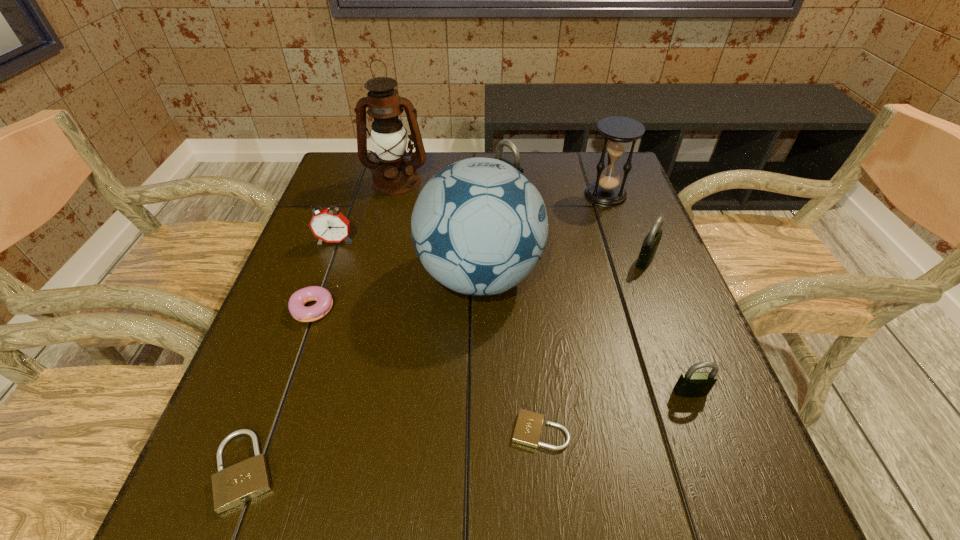
The image size is (960, 540). What are the coordinates of `object located in the far right corner section of the desktop` in the screenshot? It's located at (618, 132).

This screenshot has width=960, height=540. In the image, there is a desktop. Identify the location of vacant space at the far edge. (537, 173).

What are the coordinates of `vacant space at the near edge of the desktop` in the screenshot? It's located at (473, 514).

Find the location of `vacant region at the left edge of the desktop`. vacant region at the left edge of the desktop is located at coordinates (288, 274).

In the image, there is a desktop. Identify the location of vacant space at the right edge. (651, 393).

You are a GUI agent. You are given a task and a screenshot of the screen. Output one action in this format:
    pyautogui.click(x=<x>, y=<y>)
    Task: Click on the free space at the far left corner of the desktop
    
    Given the screenshot: What is the action you would take?
    pyautogui.click(x=329, y=179)

Where is `blank region between the lantern and the fourth tallest padlock`? This screenshot has width=960, height=540. blank region between the lantern and the fourth tallest padlock is located at coordinates (321, 326).

Where is `vacant area that lies between the third tallest padlock and the second biggest black padlock`? vacant area that lies between the third tallest padlock and the second biggest black padlock is located at coordinates (668, 326).

The image size is (960, 540). What are the coordinates of `empty location between the doughnut and the smaller beige padlock` in the screenshot? It's located at (427, 369).

Find the location of a particular element. free space that is in between the soccer ball and the shortest padlock is located at coordinates (510, 354).